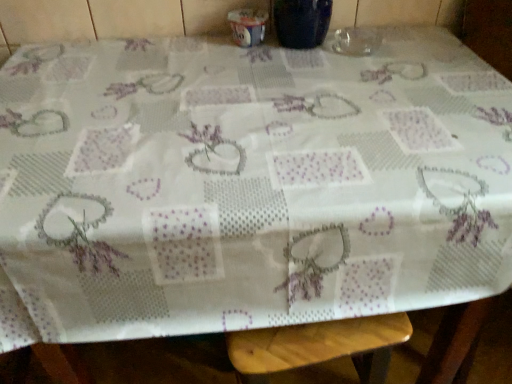
What are the coordinates of `matte dark blue glass vase at upper center` in the screenshot? It's located at (302, 22).

Measure the distance between matte dark blue glass vase at upper center and camera.

33.76 inches.

What do you see at coordinates (302, 22) in the screenshot? Image resolution: width=512 pixels, height=384 pixels. I see `matte dark blue glass vase at upper center` at bounding box center [302, 22].

What are the coordinates of `matte dark blue glass vase at upper center` in the screenshot? It's located at (302, 22).